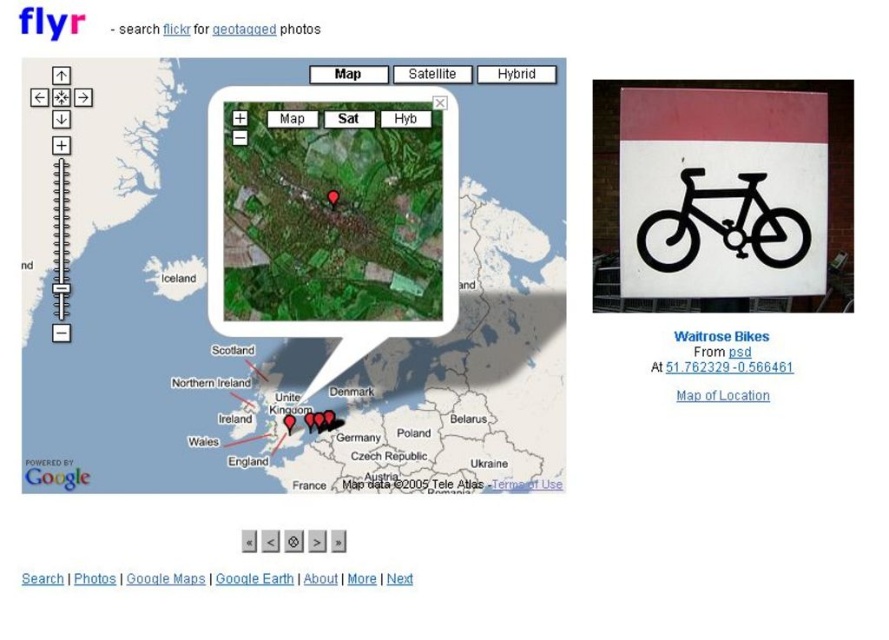
Question: Estimate the real-world distances between objects in this image. Which object is farther from the white matte signboard at center?

Choices:
 (A) black matte bicycle at center
 (B) white paper sign at center

Answer: (B)

Question: Is black matte bicycle at center bigger than white paper sign at center?

Choices:
 (A) yes
 (B) no

Answer: (A)

Question: Estimate the real-world distances between objects in this image. Which object is farther from the white paper sign at center?

Choices:
 (A) white matte signboard at center
 (B) white matte bicycle sign at center
 (C) black matte bicycle at center

Answer: (A)

Question: Does black matte bicycle at center appear over white paper sign at center?

Choices:
 (A) no
 (B) yes

Answer: (B)

Question: Which point appears farthest from the camera in this image?

Choices:
 (A) (410, 332)
 (B) (242, 332)

Answer: (A)

Question: Can you confirm if black matte bicycle at center is positioned above white paper sign at center?

Choices:
 (A) yes
 (B) no

Answer: (A)